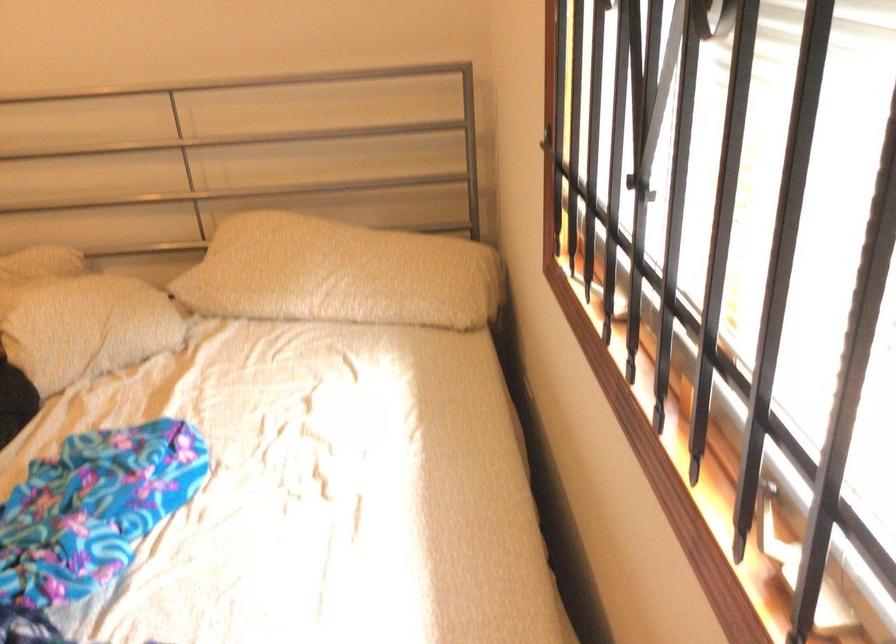
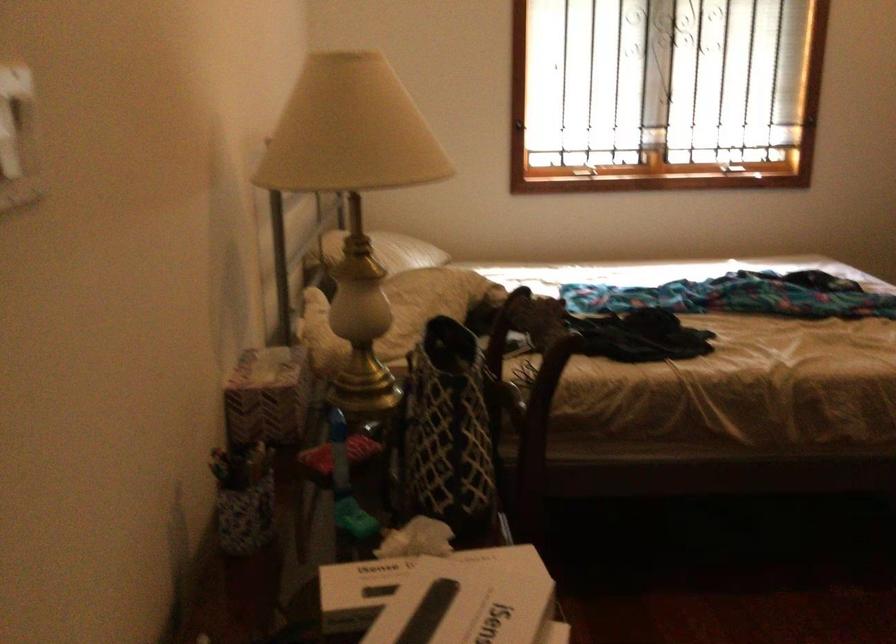
Find the pixel in the second image that matches (282,260) in the first image.

(388, 251)